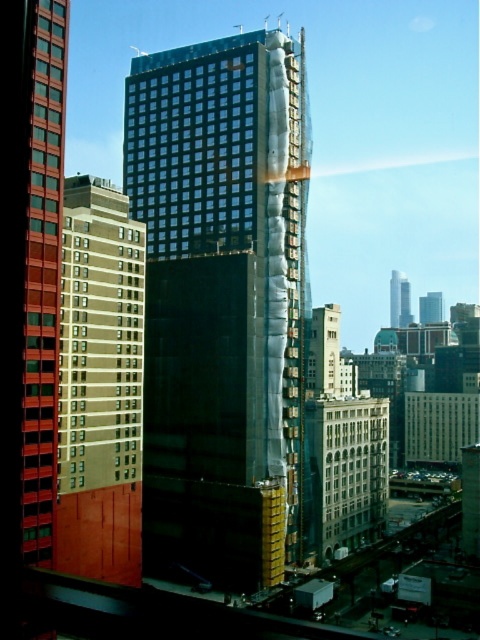
Is dark glass windows at center behind matte red glass windows at left?

Yes, dark glass windows at center is behind matte red glass windows at left.

Locate an element on the screen. dark glass windows at center is located at coordinates (192, 148).

Does metallic silver building at center appear on the left side of smooth glass skyscraper at center?

Indeed, metallic silver building at center is positioned on the left side of smooth glass skyscraper at center.

I want to click on metallic silver building at center, so click(x=324, y=352).

From the picture: Measure the distance between point [330,355] and camera.

133.46 meters

Identify the location of metallic silver building at center. This screenshot has height=640, width=480. (324, 352).

Between point (110, 358) and point (347, 397), which one is positioned in front?

Point (110, 358) is in front.

Which of these two, beige glass windows at left or glassy reflective windows at center, stands taller?

beige glass windows at left

In order to click on beige glass windows at left in this screenshot , I will do `click(100, 349)`.

Where is `beige glass windows at left`? This screenshot has height=640, width=480. beige glass windows at left is located at coordinates (100, 349).